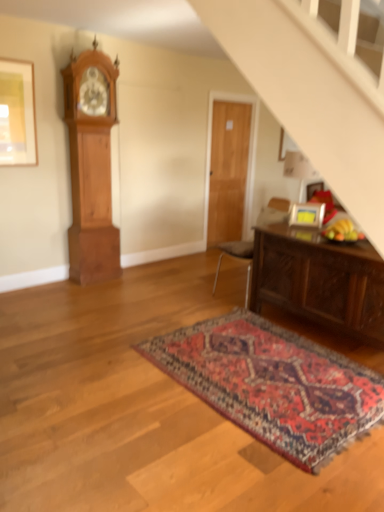
Question: Is wooden door at center bigger than brown leather chair at center?

Choices:
 (A) no
 (B) yes

Answer: (A)

Question: Does wooden door at center appear on the right side of brown leather chair at center?

Choices:
 (A) no
 (B) yes

Answer: (A)

Question: Is there a large distance between wooden door at center and brown leather chair at center?

Choices:
 (A) yes
 (B) no

Answer: (A)

Question: Is wooden door at center facing away from brown leather chair at center?

Choices:
 (A) yes
 (B) no

Answer: (B)

Question: Considering the relative sizes of wooden door at center and brown leather chair at center in the image provided, is wooden door at center smaller than brown leather chair at center?

Choices:
 (A) yes
 (B) no

Answer: (A)

Question: Is wooden door at center to the left of brown leather chair at center from the viewer's perspective?

Choices:
 (A) no
 (B) yes

Answer: (B)

Question: Is the position of matte gold picture frame at upper right, which ranks as the 2th picture frame in left-to-right order, more distant than that of carpeted rug at center?

Choices:
 (A) no
 (B) yes

Answer: (B)

Question: Is matte gold picture frame at upper right, positioned as the second picture frame in top-to-bottom order, to the right of carpeted rug at center from the viewer's perspective?

Choices:
 (A) yes
 (B) no

Answer: (A)

Question: From the image's perspective, is matte gold picture frame at upper right, which ranks as the 2th picture frame in left-to-right order, under carpeted rug at center?

Choices:
 (A) no
 (B) yes

Answer: (A)

Question: From a real-world perspective, is matte gold picture frame at upper right, the first picture frame from the bottom, below carpeted rug at center?

Choices:
 (A) yes
 (B) no

Answer: (B)

Question: Is matte gold picture frame at upper right, the first picture frame from the bottom, turned away from carpeted rug at center?

Choices:
 (A) yes
 (B) no

Answer: (B)

Question: Considering the relative sizes of matte gold picture frame at upper right, the first picture frame from the bottom, and carpeted rug at center in the image provided, is matte gold picture frame at upper right, the first picture frame from the bottom, smaller than carpeted rug at center?

Choices:
 (A) no
 (B) yes

Answer: (B)

Question: From a real-world perspective, is wooden grandfather clock at left positioned under dark brown wooden table at lower right based on gravity?

Choices:
 (A) yes
 (B) no

Answer: (B)